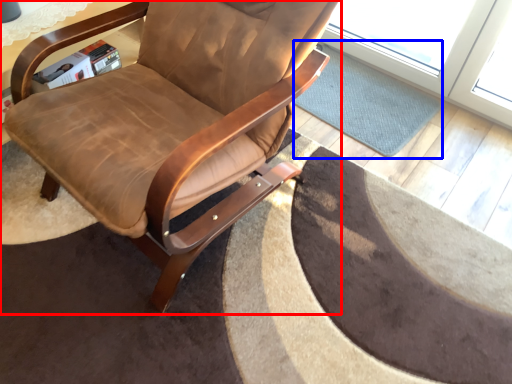
Question: Which object appears closest to the camera in this image, chair (highlighted by a red box) or mat (highlighted by a blue box)?

Choices:
 (A) chair
 (B) mat

Answer: (A)